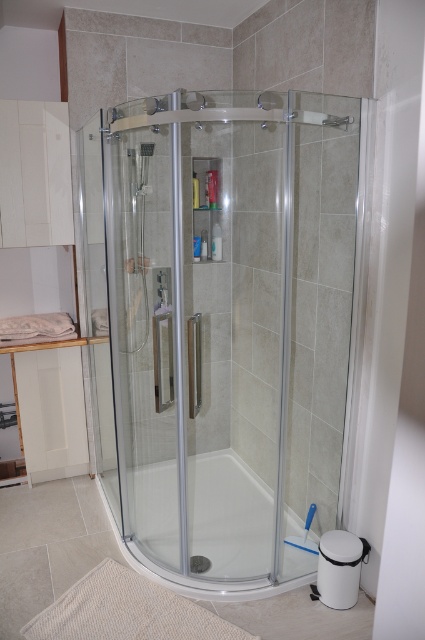
You are standing in the bathroom and want to reach both points mentioned. Which point, point [248,541] or point [212,460], is closer to you?

Point [248,541] is closer to the viewer than point [212,460].

You are designing a bathroom layout and want to place a tall plant next to the transparent glass shower door at center and the transparent glass bathtub at center. Which object should the plant be placed next to if it needs to be shorter than the object?

The transparent glass shower door at center is taller than the transparent glass bathtub at center, so the plant should be placed next to the transparent bathtub at center to ensure it is shorter than the object.

From the picture: You are standing in the bathroom and want to enter the shower area. Which object, the transparent glass shower door at center or the transparent glass bathtub at center, should you approach first?

You should approach the transparent glass shower door at center first because it is closer to you than the transparent glass bathtub at center.